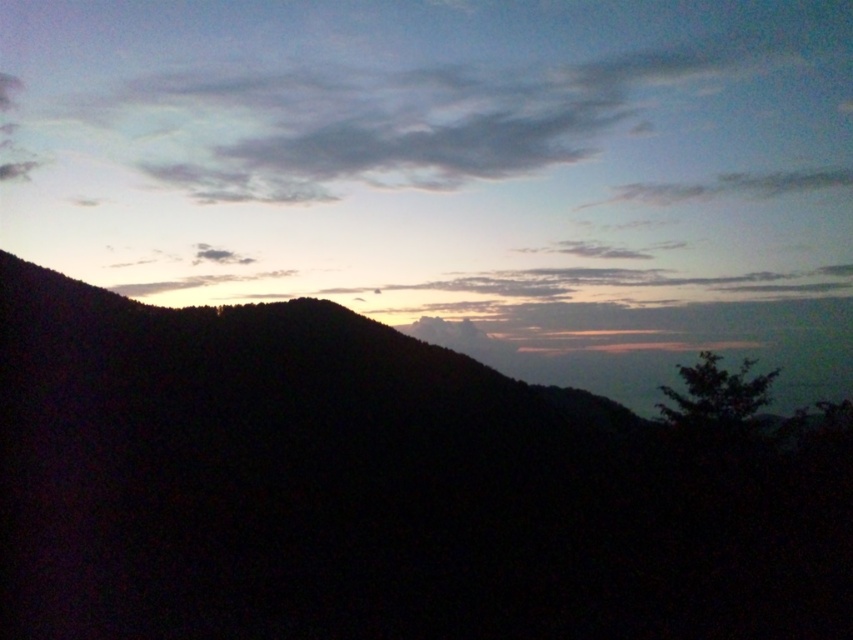
You are an artist painting this landscape and want to ensure the matte orange sky at upper center and the silhouette mountain at left are proportionally accurate. Based on the scene, which object should you make larger in your painting?

The matte orange sky at upper center should be made larger than the silhouette mountain at left since it has a larger size compared to the silhouette mountain at left according to the description.